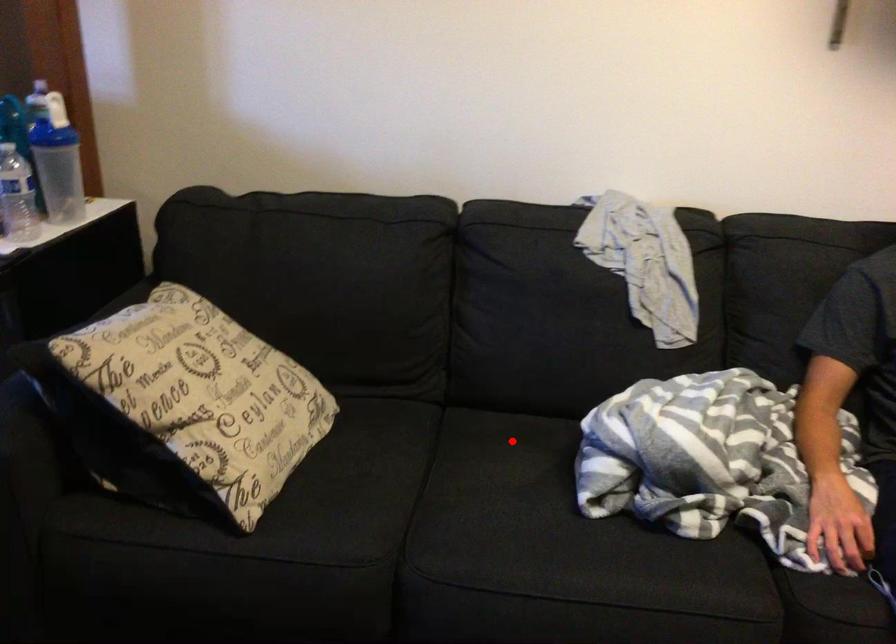
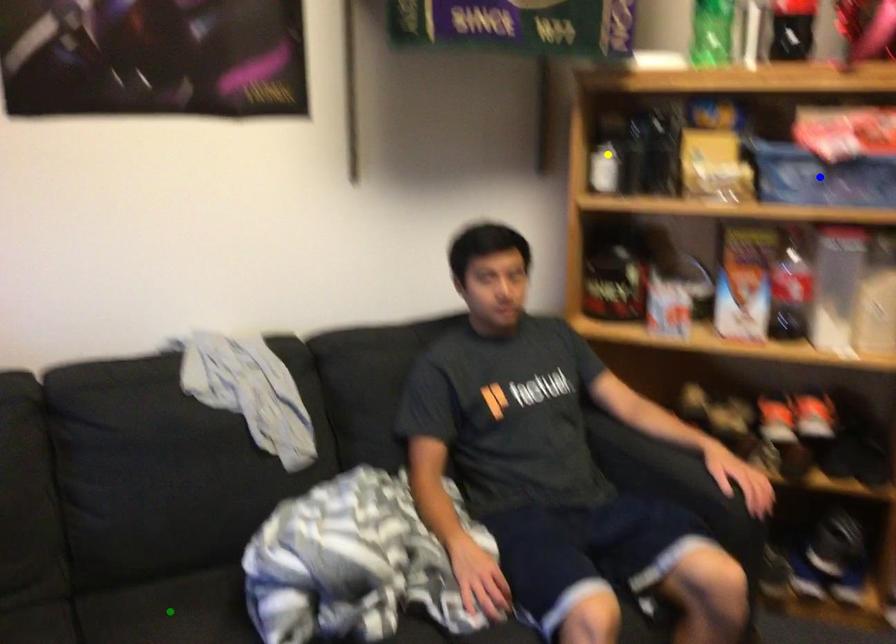
Question: I am providing you with two images of the same scene from different viewpoints. A red point is marked on the first image. You are given multiple points on the second image. In image 2, which mark is for the same physical point as the one in image 1?

Choices:
 (A) yellow point
 (B) blue point
 (C) green point

Answer: (C)